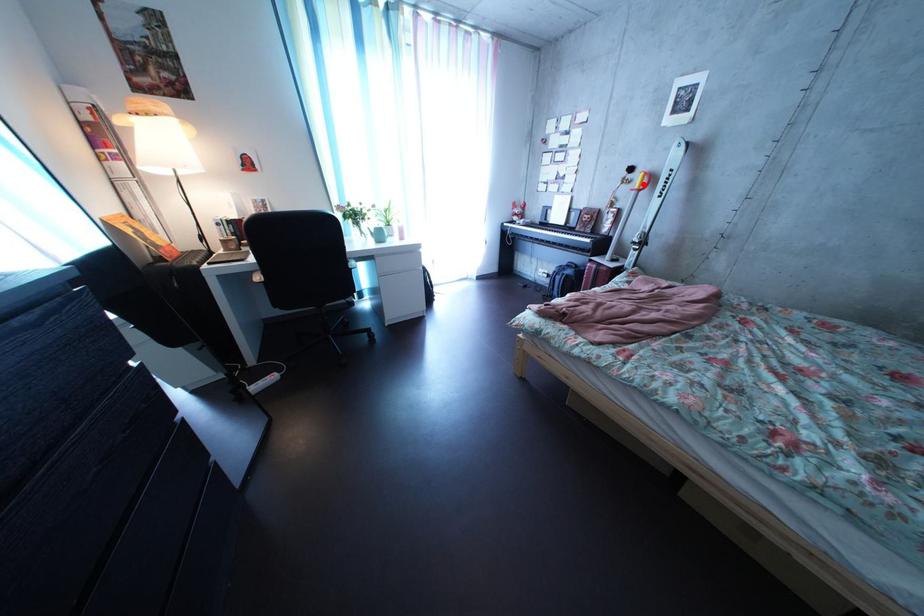
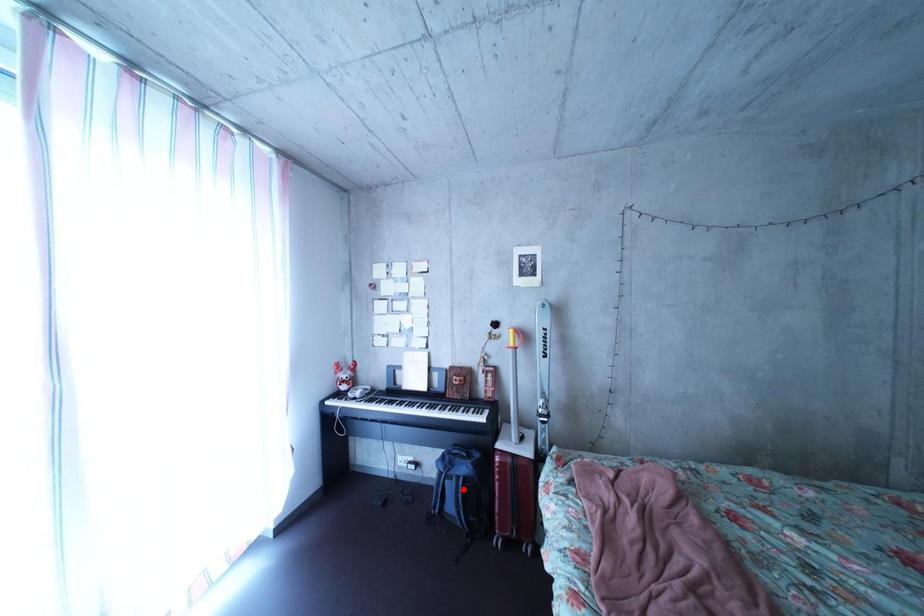
I am providing you with two images of the same scene from different viewpoints. A red point is marked on the first image and another point is marked on the second image. Does the point marked in image1 correspond to the same location as the one in image2?

No